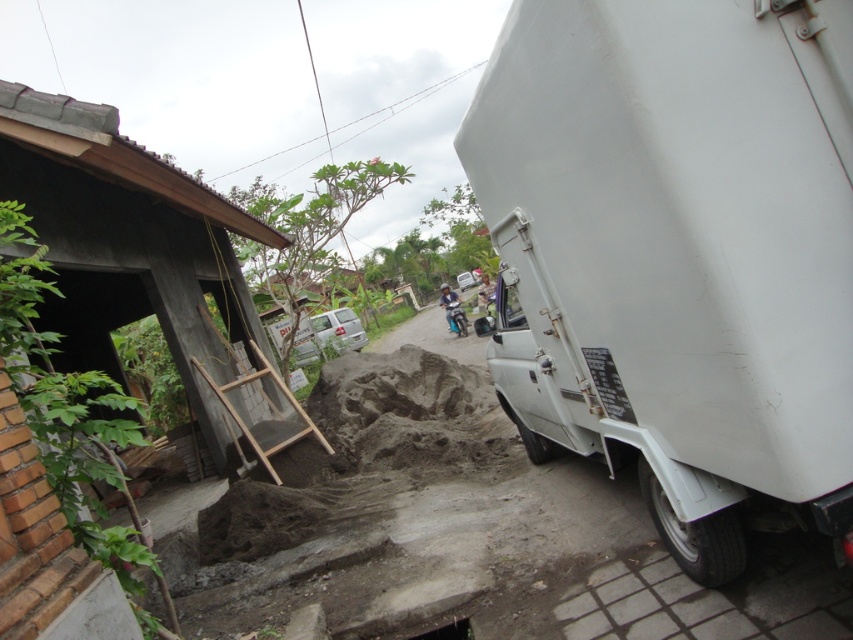
Can you confirm if smooth concrete hut at left is wider than wooden ladder at lower left?

No.

Is point (109, 186) less distant than point (247, 381)?

That is True.

Is point (41, 234) positioned in front of point (289, 397)?

Yes.

Where is `smooth concrete hut at left`? The width and height of the screenshot is (853, 640). smooth concrete hut at left is located at coordinates (128, 243).

Where is `white matte truck at right`? This screenshot has height=640, width=853. white matte truck at right is located at coordinates (676, 252).

Which is below, white matte truck at right or smooth concrete hut at left?

white matte truck at right

Is point (676, 163) farther from camera compared to point (112, 216)?

No, (676, 163) is closer to viewer.

Image resolution: width=853 pixels, height=640 pixels. Identify the location of white matte truck at right. (676, 252).

Who is shorter, white matte truck at right or wooden ladder at lower left?

wooden ladder at lower left

Who is positioned more to the left, white matte truck at right or wooden ladder at lower left?

Positioned to the left is wooden ladder at lower left.

The image size is (853, 640). What do you see at coordinates (676, 252) in the screenshot?
I see `white matte truck at right` at bounding box center [676, 252].

The height and width of the screenshot is (640, 853). In order to click on white matte truck at right in this screenshot , I will do (x=676, y=252).